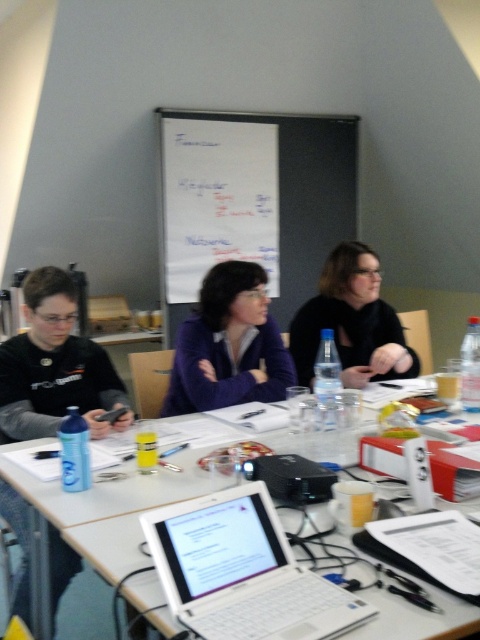
You are a delivery robot with a package that needs to be placed between the white plastic laptop at center and the matte black shirt at left. The package is 1 meter long. Will it fit between them?

The distance between the white plastic laptop at center and the matte black shirt at left is 84.38 centimeters. Since the package is 1 meter long, which is longer than the available space, it will not fit between them.

You are organizing a photo shoot and need to ensure that the matte black shirt at left and the black matte jacket at center are visible in the frame. Given their sizes, which object should you focus on first to ensure it fits within the camera frame?

The matte black shirt at left is bigger than the black matte jacket at center, so you should focus on ensuring the matte black shirt at left fits first since it requires more space in the camera frame.